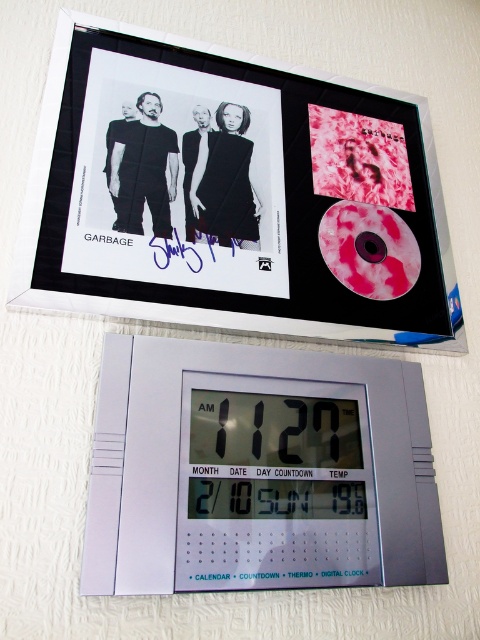
Is matte black album cover at upper center positioned in front of silver plastic digital clock at upper center?

No, it is behind silver plastic digital clock at upper center.

Does point (300, 113) lie behind point (203, 364)?

Yes, point (300, 113) is behind point (203, 364).

What are the coordinates of `matte black album cover at upper center` in the screenshot? It's located at (231, 195).